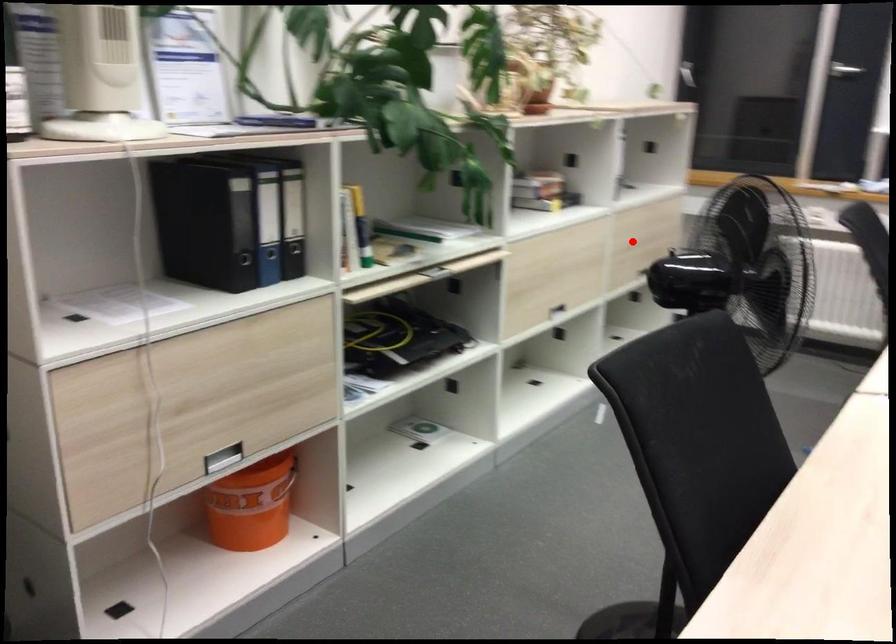
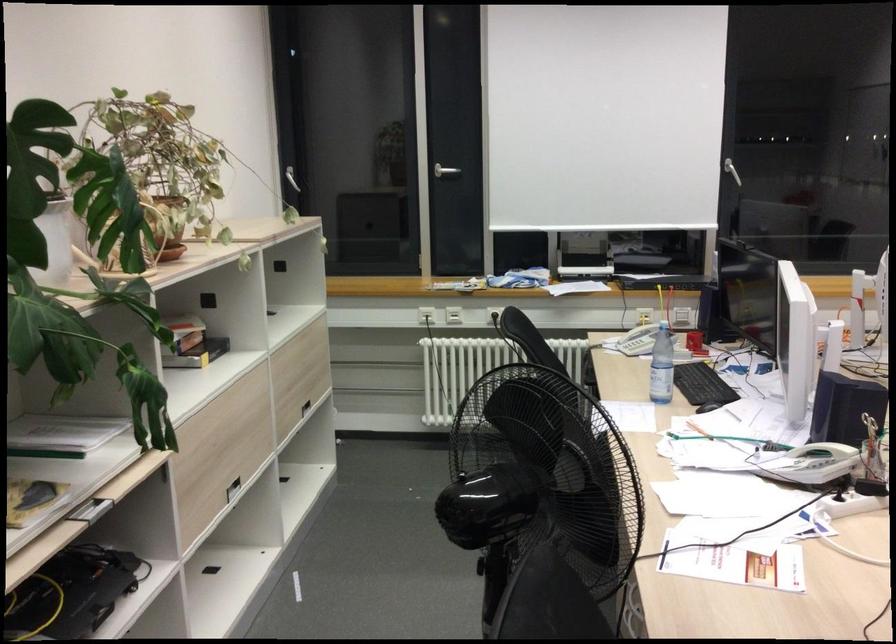
Question: I am providing you with two images of the same scene from different viewpoints. Given a red point in image1, look at the same physical point in image2. Is it:

Choices:
 (A) Closer to the viewpoint
 (B) Farther from the viewpoint

Answer: (A)